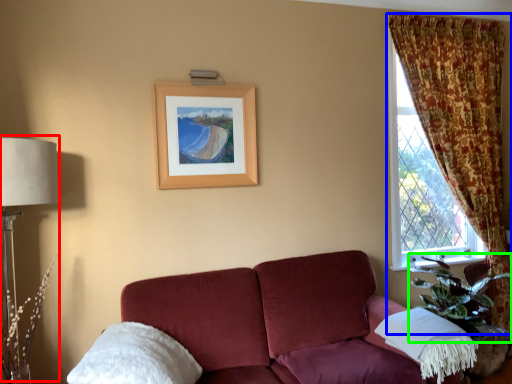
Question: Estimate the real-world distances between objects in this image. Which object is farther from table lamp (highlighted by a red box), curtain (highlighted by a blue box) or plant (highlighted by a green box)?

Choices:
 (A) curtain
 (B) plant

Answer: (A)